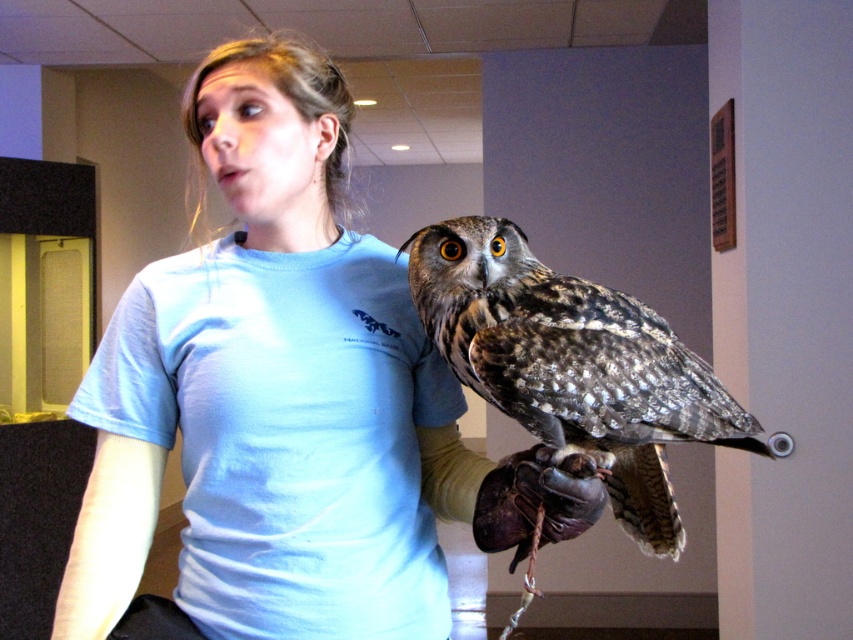
Which is more to the right, light blue t-shirt at center or light blue fabric at upper left?

light blue t-shirt at center

The width and height of the screenshot is (853, 640). What do you see at coordinates (285, 403) in the screenshot?
I see `light blue t-shirt at center` at bounding box center [285, 403].

Between point (270, 144) and point (113, 435), which one is positioned behind?

The point (113, 435) is more distant.

Find the location of `light blue t-shirt at center`. light blue t-shirt at center is located at coordinates (285, 403).

Between light blue fabric at upper left and leather glove at center, which one has less height?

leather glove at center

Is light blue fabric at upper left thinner than leather glove at center?

Indeed, light blue fabric at upper left has a lesser width compared to leather glove at center.

Does point (102, 420) come behind point (560, 483)?

Yes.

This screenshot has width=853, height=640. In order to click on light blue fabric at upper left in this screenshot , I will do `click(117, 472)`.

This screenshot has width=853, height=640. Identify the location of speckled feathered owl at center. (573, 365).

Who is positioned more to the left, speckled feathered owl at center or light blue fabric at upper left?

light blue fabric at upper left

Does point (526, 392) lie behind point (97, 403)?

No.

Locate an element on the screen. Image resolution: width=853 pixels, height=640 pixels. speckled feathered owl at center is located at coordinates [573, 365].